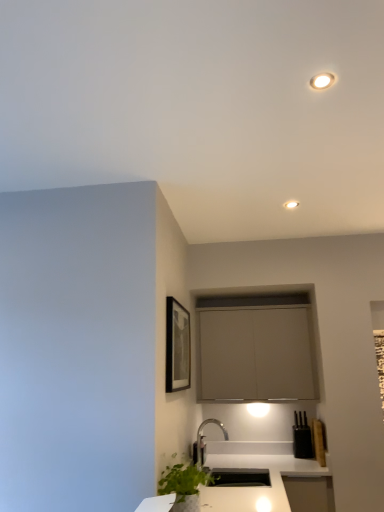
Find the location of a particular element. Image resolution: width=384 pixels, height=512 pixels. vacant space in front of matte white recessed light at upper center is located at coordinates (307, 192).